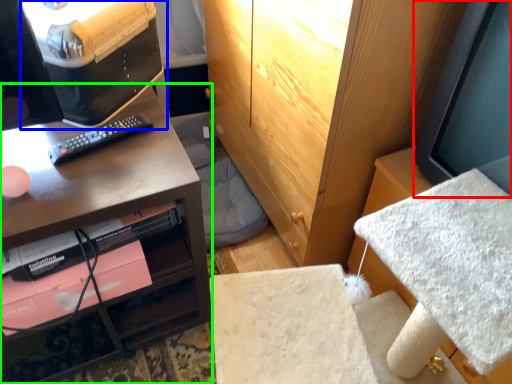
Question: Which is nearer to the computer monitor (highlighted by a red box)? desktop computer (highlighted by a blue box) or desk (highlighted by a green box).

Choices:
 (A) desktop computer
 (B) desk

Answer: (B)